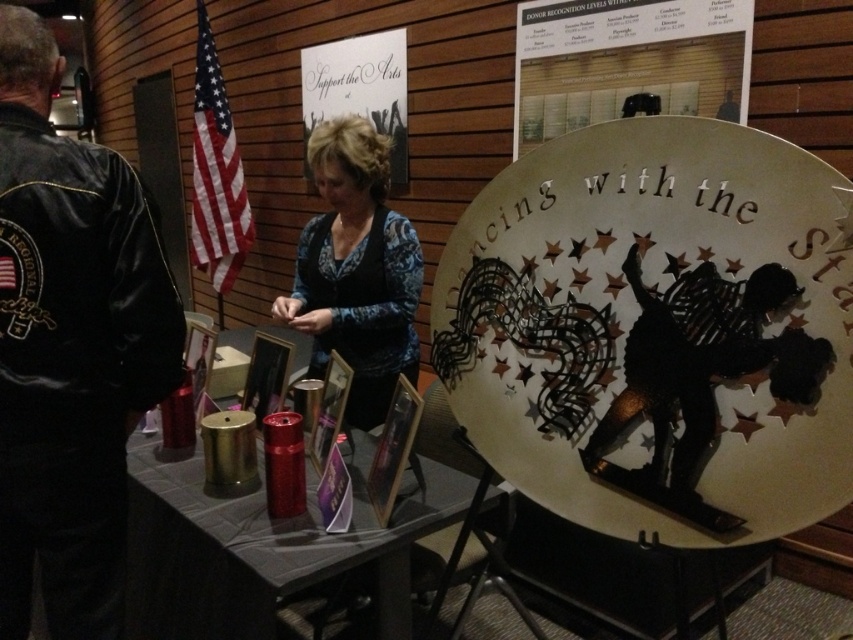
You are an event volunteer who needs to place a new item on the table. The metallic red thermos at lower center and the blue patterned sweater at center are already there. Since the thermos is shorter than the sweater, where should you place the new item to avoid blocking the view of the thermos?

Place the new item next to the metallic red thermos at lower center since it is shorter than the blue patterned sweater at center, so placing it there won

You are standing at the back of the table and want to grab the metallic red thermos at lower center. Which direction should you move relative to the blue patterned sweater at center?

The metallic red thermos at lower center is to the left of the blue patterned sweater at center, so you should move to the left of the blue patterned sweater at center to reach it.

You are standing in front of the table at the event. There are two points marked in the scene. Which point is closer to you, point (47, 353) or point (373, 371)?

Point (47, 353) is closer to the viewer than point (373, 371).